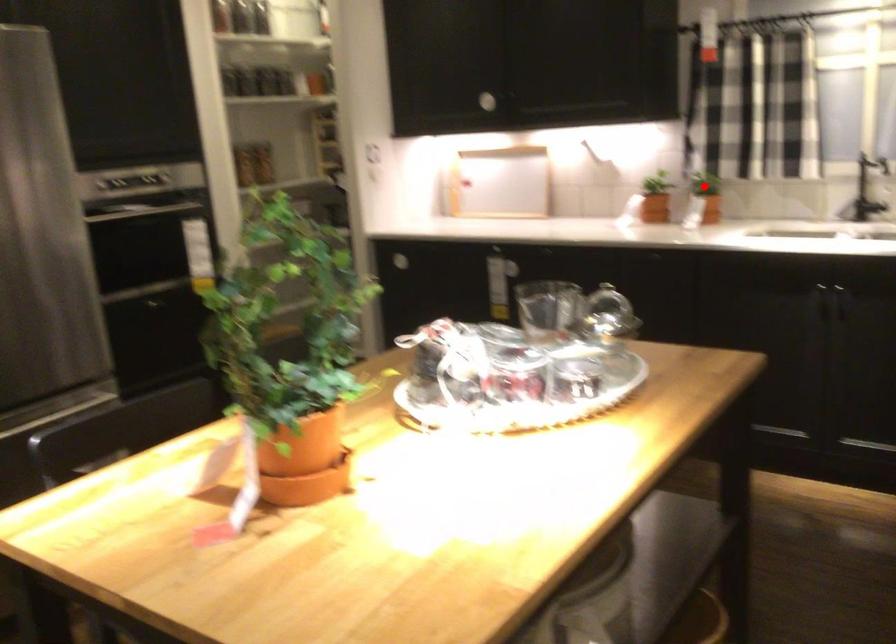
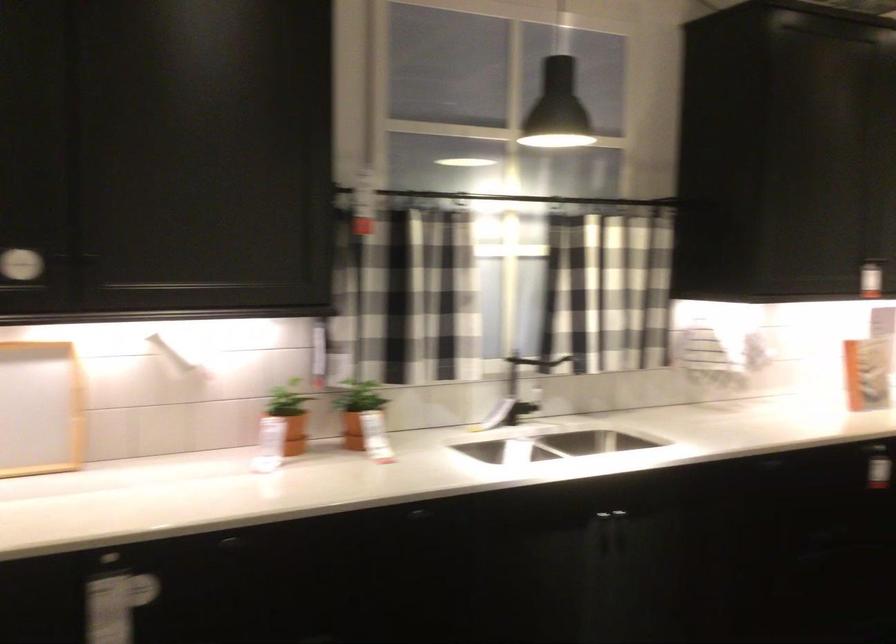
Locate, in the second image, the point that corresponds to the highlighted location in the first image.

(357, 410)